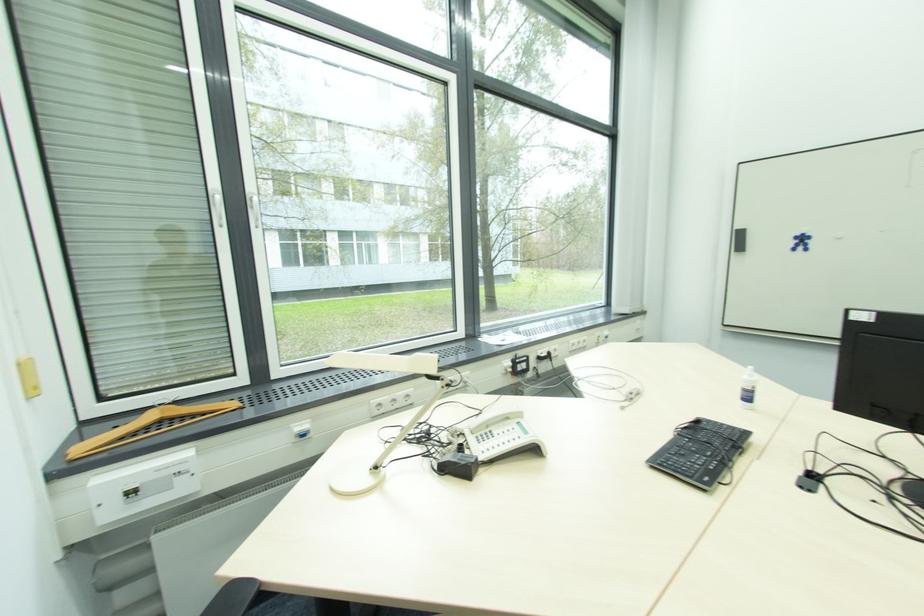
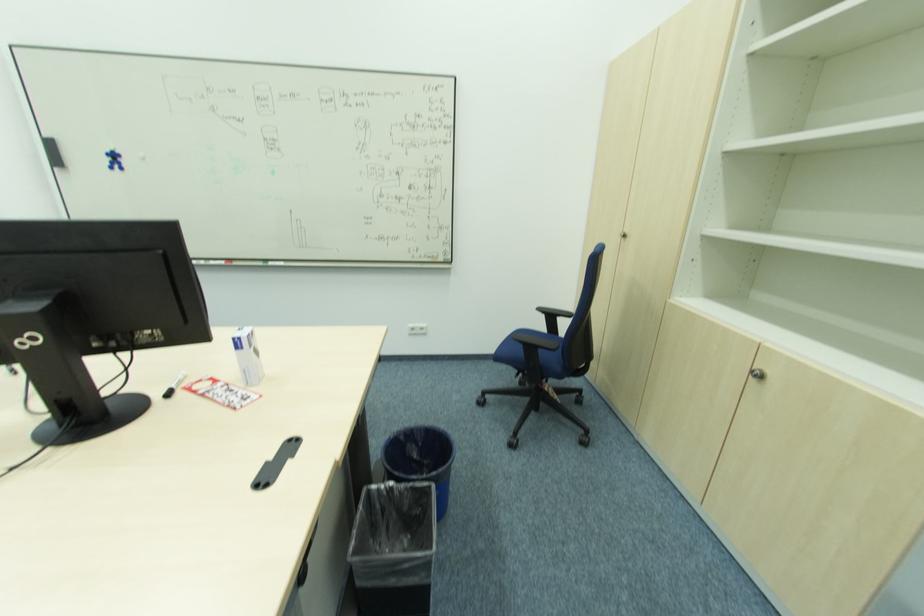
Locate, in the second image, the point that corresponds to point (801, 244) in the first image.

(116, 161)